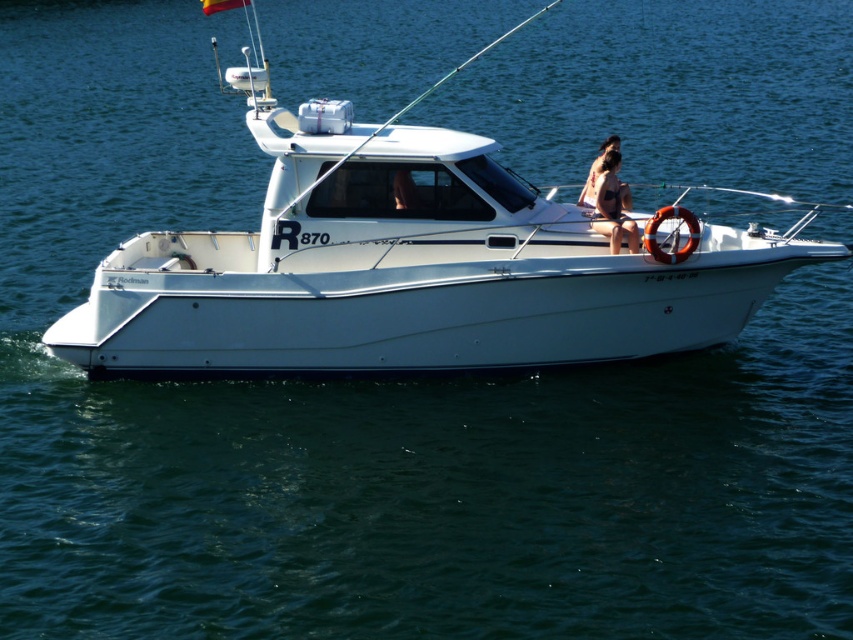
Does white matte boat at center have a lesser width compared to tan skin person at center?

In fact, white matte boat at center might be wider than tan skin person at center.

Can you confirm if white matte boat at center is positioned to the right of tan skin person at center?

Incorrect, white matte boat at center is not on the right side of tan skin person at center.

Is point (846, 253) closer to viewer compared to point (577, 200)?

Yes, it is.

Where is `white matte boat at center`? This screenshot has height=640, width=853. white matte boat at center is located at coordinates pos(412,264).

Does tan skin bikini at center have a lesser width compared to tan skin person at center?

Yes.

Does tan skin bikini at center appear under tan skin person at center?

Yes, tan skin bikini at center is below tan skin person at center.

Describe the element at coordinates (613, 205) in the screenshot. The image size is (853, 640). I see `tan skin bikini at center` at that location.

Where is `tan skin bikini at center`? Image resolution: width=853 pixels, height=640 pixels. tan skin bikini at center is located at coordinates pyautogui.click(x=613, y=205).

Is white matte boat at center to the right of tan skin bikini at center from the viewer's perspective?

No, white matte boat at center is not to the right of tan skin bikini at center.

Which is more to the left, white matte boat at center or tan skin bikini at center?

Positioned to the left is white matte boat at center.

Is point (717, 289) positioned in front of point (625, 221)?

No, it is behind (625, 221).

Identify the location of white matte boat at center. (412, 264).